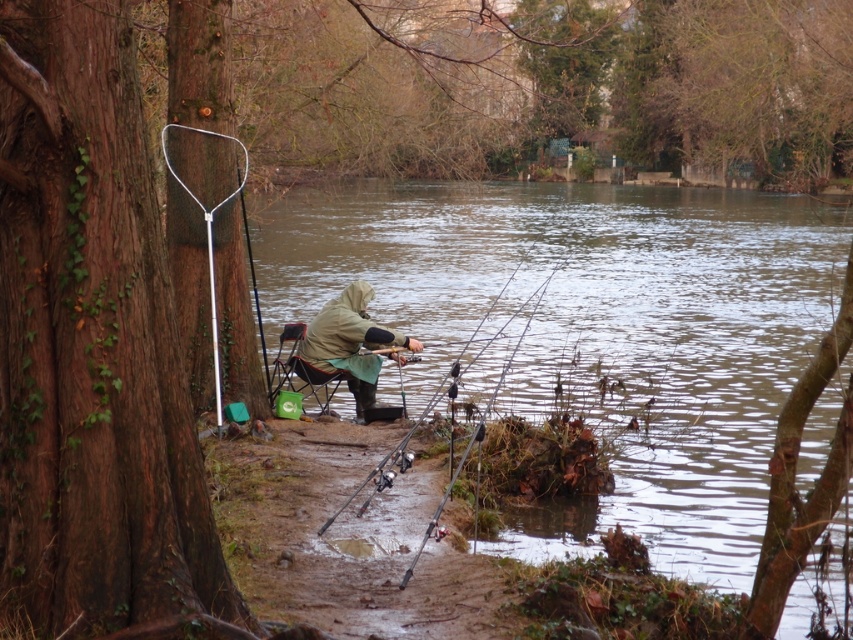
Question: Is khaki fabric jacket at center further to camera compared to black plastic fishing pole at center?

Choices:
 (A) yes
 (B) no

Answer: (A)

Question: Which of these objects is positioned farthest from the brown rough tree trunk at left?

Choices:
 (A) khaki fabric jacket at center
 (B) clear water at center
 (C) black plastic fishing pole at center

Answer: (B)

Question: Can you confirm if brown rough tree trunk at left is thinner than khaki fabric jacket at center?

Choices:
 (A) yes
 (B) no

Answer: (A)

Question: Does clear water at center have a larger size compared to brown rough tree trunk at left?

Choices:
 (A) yes
 (B) no

Answer: (A)

Question: Which object is closer to the camera taking this photo?

Choices:
 (A) brown rough tree trunk at left
 (B) black plastic fishing pole at center
 (C) clear water at center
 (D) khaki fabric jacket at center

Answer: (A)

Question: Which object is positioned closest to the clear water at center?

Choices:
 (A) brown rough tree trunk at left
 (B) khaki fabric jacket at center

Answer: (A)